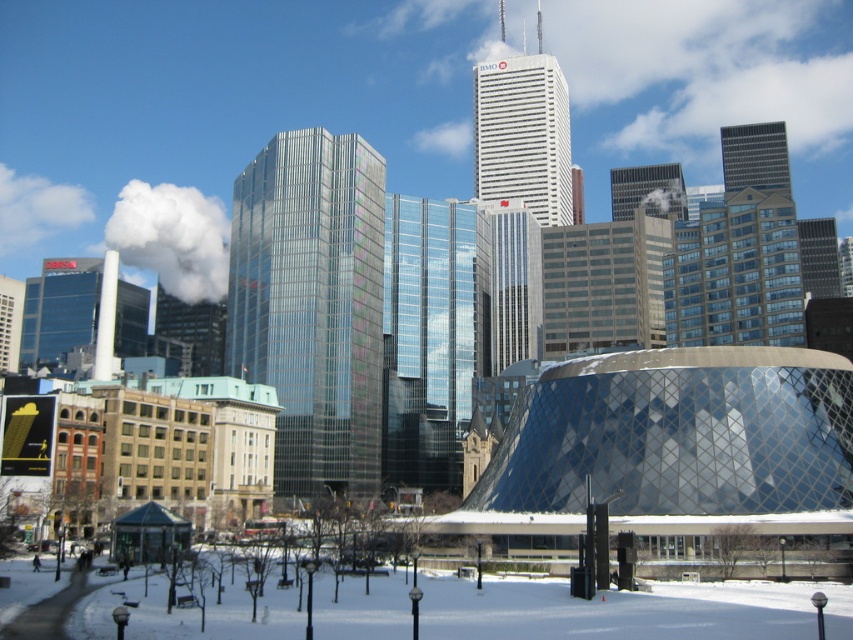
You are a city planner evaluating the skyline of Toronto. You notice the shiny glass skyscraper at center and the matte glass building at upper center. Based on their heights, which one would cast a longer shadow during midday in winter?

The shiny glass skyscraper at center is taller than the matte glass building at upper center, so it would cast a longer shadow during midday in winter.